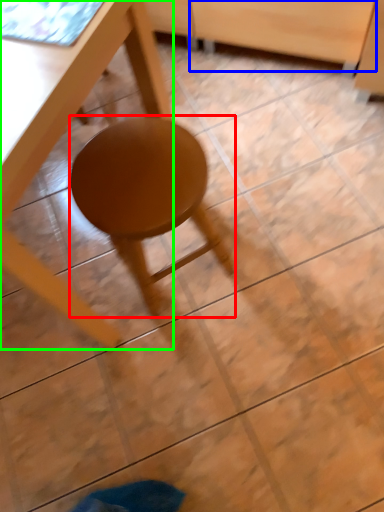
Question: Which object is positioned closest to stool (highlighted by a red box)? Select from drawer (highlighted by a blue box) and table (highlighted by a green box).

Choices:
 (A) drawer
 (B) table

Answer: (B)